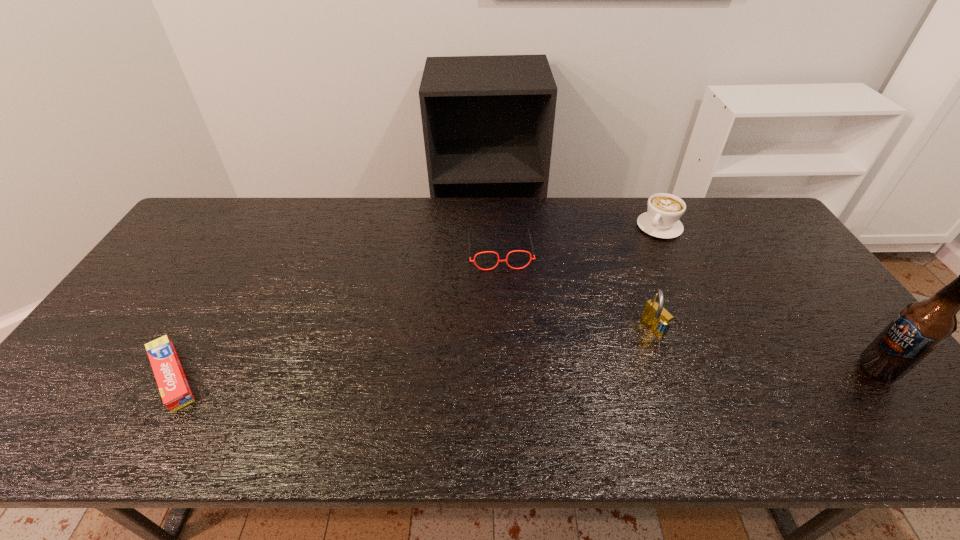
Where is `vacant area between the shortest object and the third nearest object`? This screenshot has width=960, height=540. vacant area between the shortest object and the third nearest object is located at coordinates (413, 351).

Find the location of a particular element. vacant area that lies between the second object from right to left and the leftmost object is located at coordinates (416, 301).

Locate an element on the screen. free space that is in between the spectacles and the cappuccino is located at coordinates (580, 238).

This screenshot has width=960, height=540. What are the coordinates of `vacant area that lies between the padlock and the rightmost object` in the screenshot? It's located at (765, 348).

Select which object is the third closest to the cappuccino. Please provide its 2D coordinates. Your answer should be formatted as a tuple, i.e. [(x, y)], where the tuple contains the x and y coordinates of a point satisfying the conditions above.

[(920, 327)]

Select which object is the closest to the fourth tallest object. Please provide its 2D coordinates. Your answer should be formatted as a tuple, i.e. [(x, y)], where the tuple contains the x and y coordinates of a point satisfying the conditions above.

[(654, 315)]

Locate an element on the screen. This screenshot has height=540, width=960. free point that satisfies the following two spatial constraints: 1. on the front side of the second object from left to right; 2. on the label of the tallest object is located at coordinates (506, 369).

Find the location of a particular element. The height and width of the screenshot is (540, 960). free space in the image that satisfies the following two spatial constraints: 1. on the front side of the tallest object; 2. on the label of the second object from left to right is located at coordinates (506, 369).

Where is `vacant point that satisfies the following two spatial constraints: 1. on the front side of the rightmost object; 2. on the label of the fourth tallest object`? vacant point that satisfies the following two spatial constraints: 1. on the front side of the rightmost object; 2. on the label of the fourth tallest object is located at coordinates (506, 369).

Locate an element on the screen. This screenshot has height=540, width=960. free space that satisfies the following two spatial constraints: 1. on the front side of the beer bottle; 2. on the label of the second shortest object is located at coordinates (506, 369).